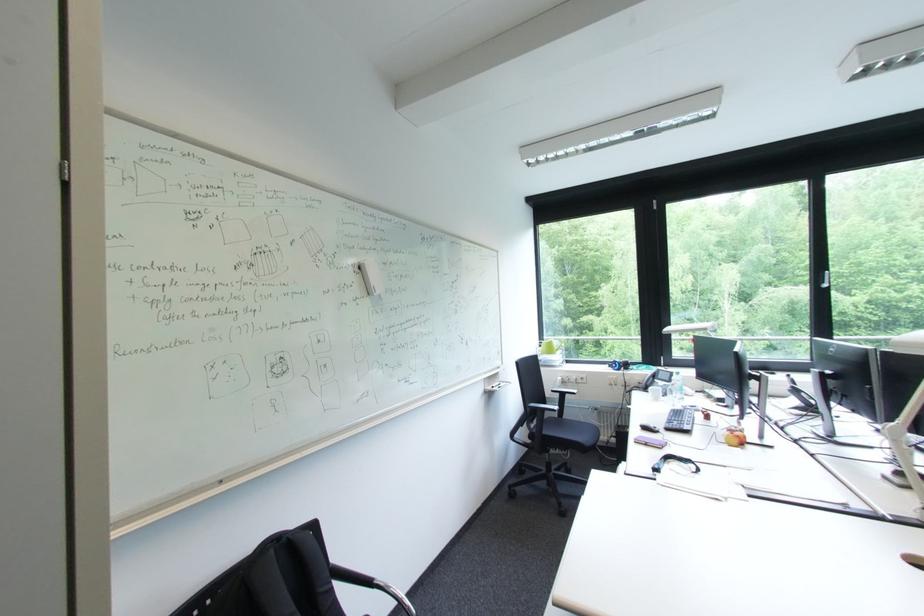
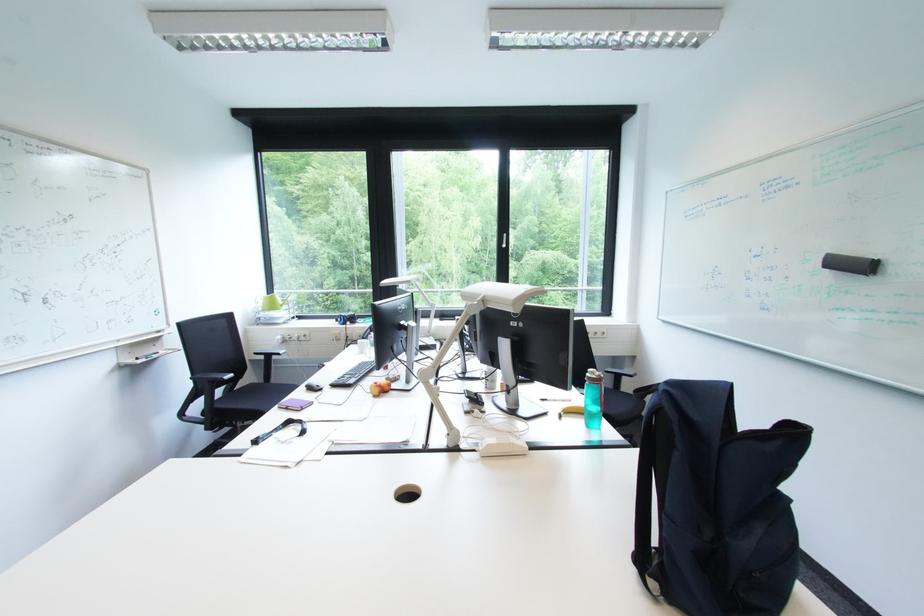
Locate, in the second image, the point that corresponds to pixel 565 418 in the first image.

(272, 383)